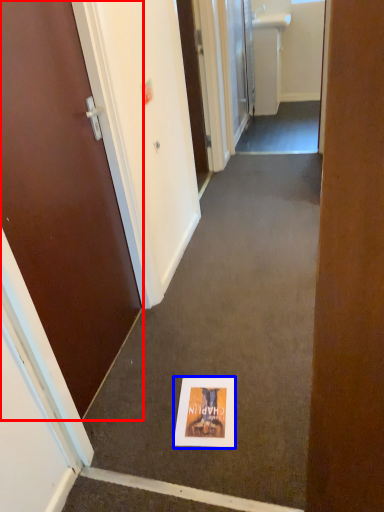
Question: Which of the following is the closest to the observer, door (highlighted by a red box) or flyer (highlighted by a blue box)?

Choices:
 (A) door
 (B) flyer

Answer: (A)